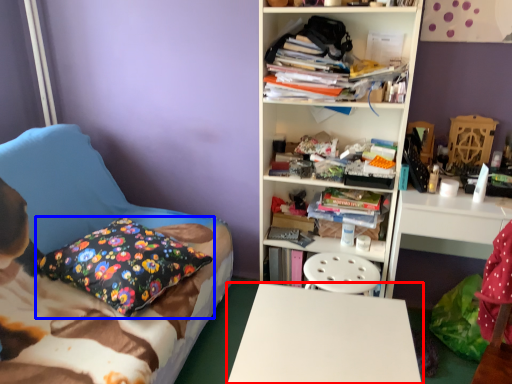
Question: Among these objects, which one is nearest to the camera, desk (highlighted by a red box) or pillow (highlighted by a blue box)?

Choices:
 (A) desk
 (B) pillow

Answer: (A)